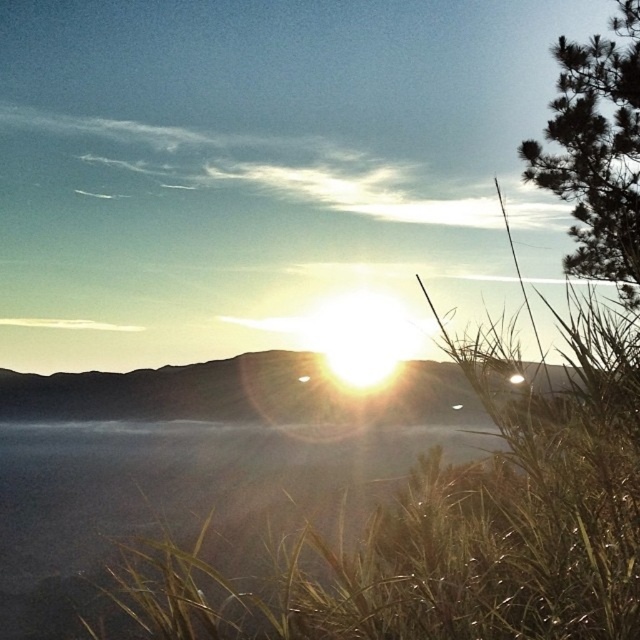
You are planning to set up a small tent for a sunset viewing. The sandy brown hillside at center and the green leafy tree at upper right are in your view. Which object would provide more horizontal space for setting up the tent?

The sandy brown hillside at center might be wider than the green leafy tree at upper right, so it would provide more horizontal space for setting up the tent.